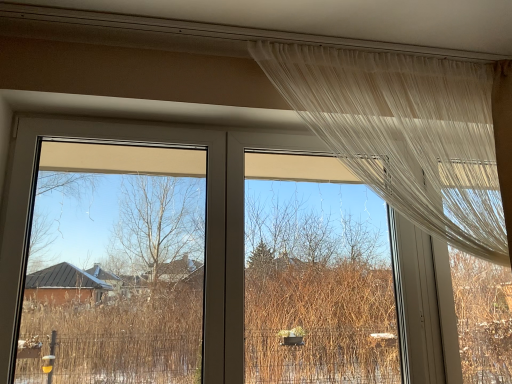
Question: Is the depth of sheer white curtain at upper right less than that of transparent plastic window screen at left, the 2th window screen positioned from the right?

Choices:
 (A) no
 (B) yes

Answer: (A)

Question: Does sheer white curtain at upper right come behind transparent plastic window screen at left, which is the first window screen in left-to-right order?

Choices:
 (A) yes
 (B) no

Answer: (A)

Question: Considering the relative sizes of sheer white curtain at upper right and transparent plastic window screen at left, the 2th window screen positioned from the right, in the image provided, is sheer white curtain at upper right wider than transparent plastic window screen at left, the 2th window screen positioned from the right,?

Choices:
 (A) no
 (B) yes

Answer: (A)

Question: Does sheer white curtain at upper right appear on the right side of transparent plastic window screen at left, the 2th window screen positioned from the right?

Choices:
 (A) yes
 (B) no

Answer: (A)

Question: Can you confirm if sheer white curtain at upper right is taller than transparent plastic window screen at left, which is the first window screen in left-to-right order?

Choices:
 (A) no
 (B) yes

Answer: (A)

Question: Considering the positions of point (356, 215) and point (93, 203), is point (356, 215) closer or farther from the camera than point (93, 203)?

Choices:
 (A) farther
 (B) closer

Answer: (B)

Question: From the image's perspective, is transparent fabric at upper center, positioned as the 1th window screen in right-to-left order, positioned above or below transparent plastic window screen at left, which is the first window screen in left-to-right order?

Choices:
 (A) below
 (B) above

Answer: (A)

Question: Is transparent fabric at upper center, placed as the second window screen when sorted from left to right, wider or thinner than transparent plastic window screen at left, which is the first window screen in left-to-right order?

Choices:
 (A) wide
 (B) thin

Answer: (B)

Question: Considering the positions of transparent fabric at upper center, placed as the second window screen when sorted from left to right, and transparent plastic window screen at left, the 2th window screen positioned from the right, in the image, is transparent fabric at upper center, placed as the second window screen when sorted from left to right, taller or shorter than transparent plastic window screen at left, the 2th window screen positioned from the right,?

Choices:
 (A) tall
 (B) short

Answer: (A)

Question: Would you say sheer white curtain at upper right is to the left or to the right of transparent plastic window screen at left, which is the first window screen in left-to-right order, in the picture?

Choices:
 (A) left
 (B) right

Answer: (B)

Question: Is sheer white curtain at upper right bigger or smaller than transparent plastic window screen at left, which is the first window screen in left-to-right order?

Choices:
 (A) big
 (B) small

Answer: (B)

Question: Is sheer white curtain at upper right wider or thinner than transparent plastic window screen at left, the 2th window screen positioned from the right?

Choices:
 (A) wide
 (B) thin

Answer: (B)

Question: Is point (290, 79) closer or farther from the camera than point (44, 192)?

Choices:
 (A) closer
 (B) farther

Answer: (A)

Question: Considering the positions of point (446, 208) and point (314, 327), is point (446, 208) closer or farther from the camera than point (314, 327)?

Choices:
 (A) farther
 (B) closer

Answer: (B)

Question: Based on their positions, is sheer white curtain at upper right located to the left or right of transparent fabric at upper center, placed as the second window screen when sorted from left to right?

Choices:
 (A) right
 (B) left

Answer: (A)